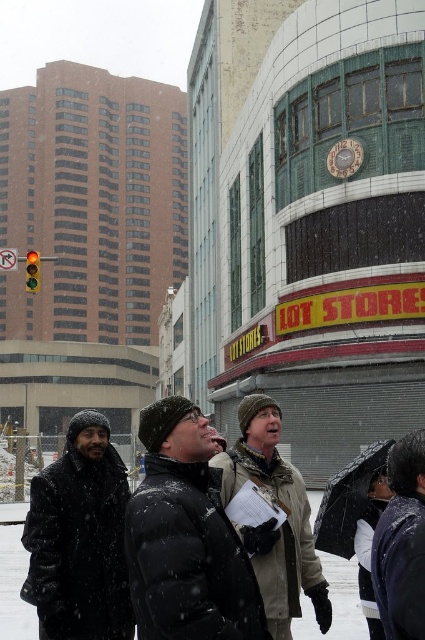
Can you confirm if khaki wool jacket at center is positioned to the right of shiny black jacket at lower right?

No, khaki wool jacket at center is not to the right of shiny black jacket at lower right.

Between point (252, 429) and point (397, 579), which one is positioned behind?

The point (252, 429) is more distant.

Locate an element on the screen. The image size is (425, 640). khaki wool jacket at center is located at coordinates (271, 518).

Between point (68, 588) and point (323, 515), which one is positioned behind?

Point (323, 515)

Can you confirm if dark gray woolen hat at lower left is smaller than transparent plastic umbrella at lower right?

Actually, dark gray woolen hat at lower left might be larger than transparent plastic umbrella at lower right.

At what (x,y) coordinates should I click in order to perform the action: click on dark gray woolen hat at lower left. Please return your answer as a coordinate pair (x, y). This screenshot has width=425, height=640. Looking at the image, I should click on (79, 538).

Find the location of a particular element. The height and width of the screenshot is (640, 425). dark gray woolen hat at lower left is located at coordinates (79, 538).

Which is in front, point (102, 596) or point (271, 520)?

Positioned in front is point (271, 520).

Is dark gray woolen hat at lower left to the left of khaki wool jacket at center from the viewer's perspective?

Indeed, dark gray woolen hat at lower left is positioned on the left side of khaki wool jacket at center.

Does point (56, 609) come behind point (257, 429)?

That is False.

Find the location of `dark gray woolen hat at lower left`. dark gray woolen hat at lower left is located at coordinates (79, 538).